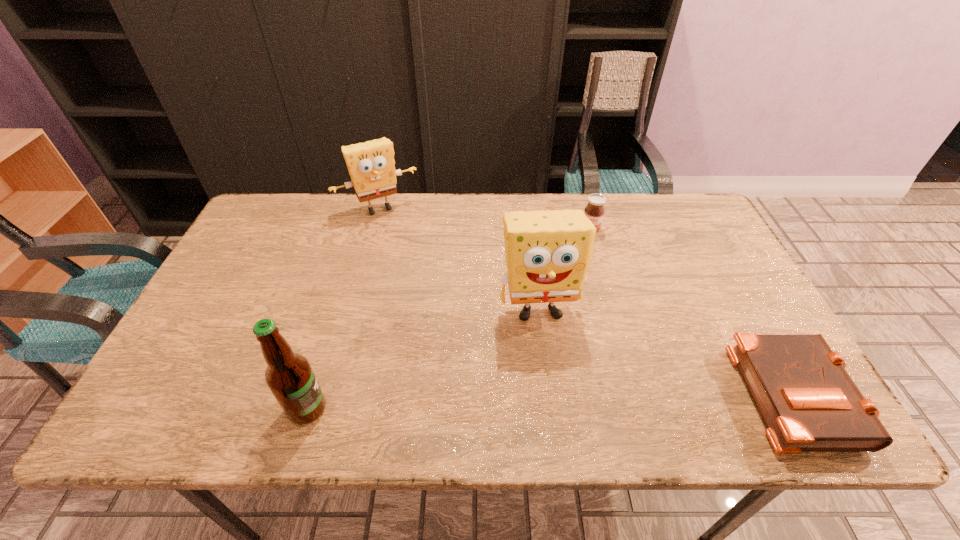
Where is `beer bottle`? This screenshot has width=960, height=540. beer bottle is located at coordinates (289, 376).

Locate an element on the screen. This screenshot has height=540, width=960. the shortest object is located at coordinates (809, 403).

Where is `Bible`? Bible is located at coordinates (809, 403).

This screenshot has height=540, width=960. I want to click on the third object from left to right, so click(x=548, y=253).

I want to click on the third farthest object, so coord(548,253).

Locate an element on the screen. This screenshot has height=540, width=960. the farthest object is located at coordinates click(x=371, y=167).

I want to click on the third tallest object, so click(x=371, y=167).

The height and width of the screenshot is (540, 960). Find the location of `the second shortest object`. the second shortest object is located at coordinates (594, 210).

Where is `jam`? The image size is (960, 540). jam is located at coordinates (594, 210).

The width and height of the screenshot is (960, 540). I want to click on free location located on the face of the third nearest object, so click(556, 384).